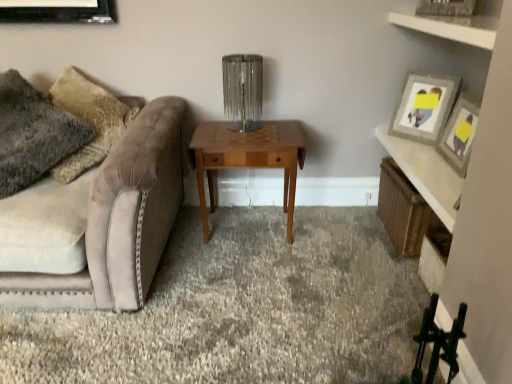
Question: Is the depth of fuzzy fabric pillow at left less than that of velvet beige couch at left?

Choices:
 (A) yes
 (B) no

Answer: (B)

Question: Is fuzzy fabric pillow at left taller than velvet beige couch at left?

Choices:
 (A) yes
 (B) no

Answer: (A)

Question: From a real-world perspective, is fuzzy fabric pillow at left on top of velvet beige couch at left?

Choices:
 (A) yes
 (B) no

Answer: (A)

Question: From a real-world perspective, is fuzzy fabric pillow at left physically below velvet beige couch at left?

Choices:
 (A) yes
 (B) no

Answer: (B)

Question: Is fuzzy fabric pillow at left outside of velvet beige couch at left?

Choices:
 (A) no
 (B) yes

Answer: (A)

Question: Is fuzzy fabric pillow at left facing towards velvet beige couch at left?

Choices:
 (A) yes
 (B) no

Answer: (A)

Question: Does white wood shelf at upper right, which is the first shelf from top to bottom, appear on the right side of carpet at center?

Choices:
 (A) yes
 (B) no

Answer: (A)

Question: Does white wood shelf at upper right, which is the first shelf from top to bottom, turn towards carpet at center?

Choices:
 (A) yes
 (B) no

Answer: (B)

Question: Is white wood shelf at upper right, arranged as the 2th shelf when viewed from the back, positioned in front of carpet at center?

Choices:
 (A) no
 (B) yes

Answer: (B)

Question: Does white wood shelf at upper right, acting as the first shelf starting from the front, have a lesser width compared to carpet at center?

Choices:
 (A) yes
 (B) no

Answer: (A)

Question: Does white wood shelf at upper right, acting as the first shelf starting from the front, appear on the left side of carpet at center?

Choices:
 (A) no
 (B) yes

Answer: (A)

Question: Is white wood shelf at upper right, the second shelf in the bottom-to-top sequence, bigger than carpet at center?

Choices:
 (A) no
 (B) yes

Answer: (A)

Question: Does fuzzy fabric pillow at left have a lesser width compared to wooden picture frame at upper right?

Choices:
 (A) yes
 (B) no

Answer: (B)